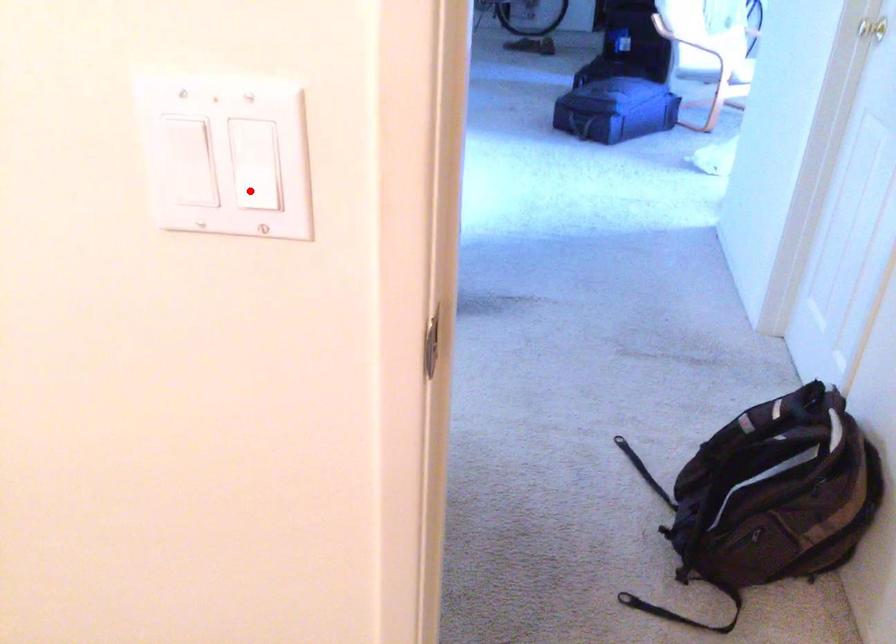
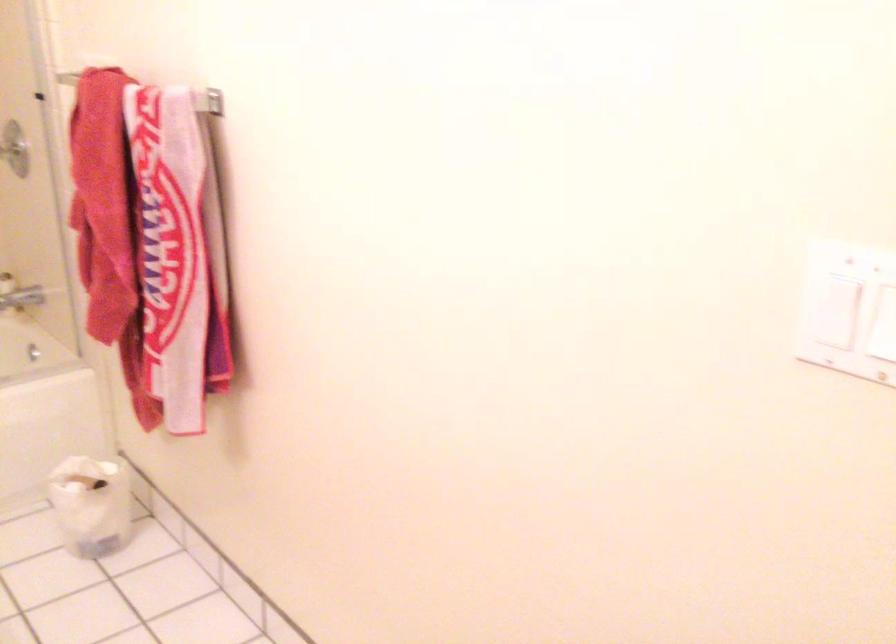
Locate, in the second image, the point that corresponds to the highlighted location in the first image.

(883, 319)